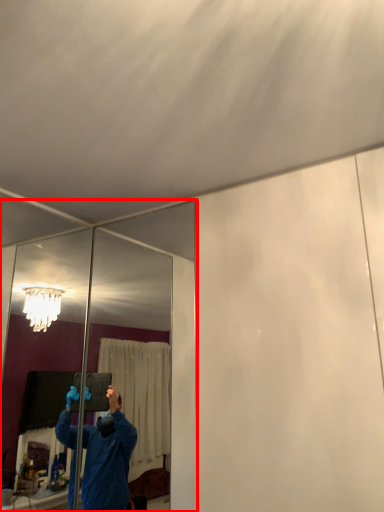
Question: Considering the relative positions of mirror (annotated by the red box) and mirror in the image provided, where is mirror (annotated by the red box) located with respect to the staircase?

Choices:
 (A) left
 (B) right

Answer: (B)